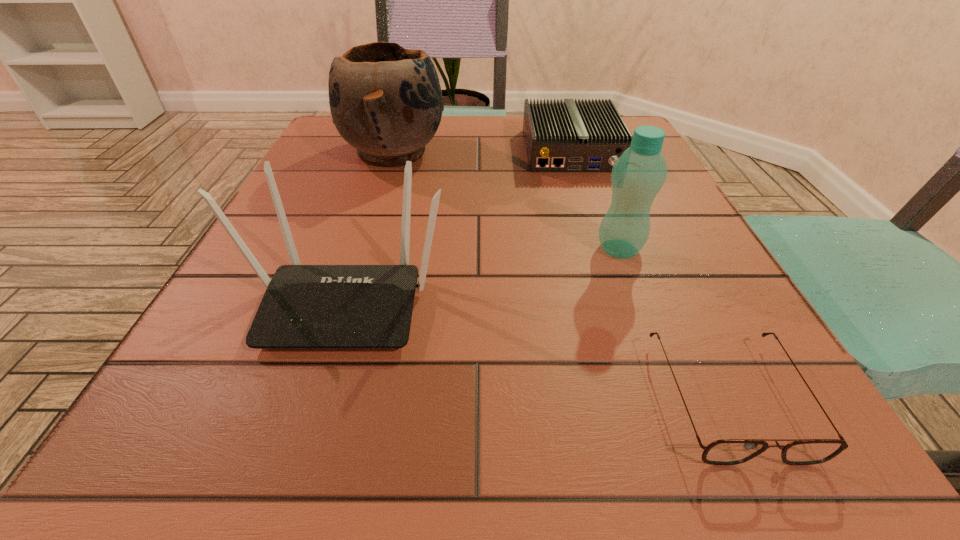
Find the location of a particular element. The height and width of the screenshot is (540, 960). vacant space that satisfies the following two spatial constraints: 1. on the back panel of the right router; 2. on the left side of the bottle is located at coordinates (604, 249).

In order to click on blank area in the image that satisfies the following two spatial constraints: 1. on the back panel of the bottle; 2. on the right side of the second shortest object in this screenshot , I will do `click(604, 249)`.

Where is `free space that satisfies the following two spatial constraints: 1. on the back panel of the bottle; 2. on the right side of the fourth tallest object`? free space that satisfies the following two spatial constraints: 1. on the back panel of the bottle; 2. on the right side of the fourth tallest object is located at coordinates (604, 249).